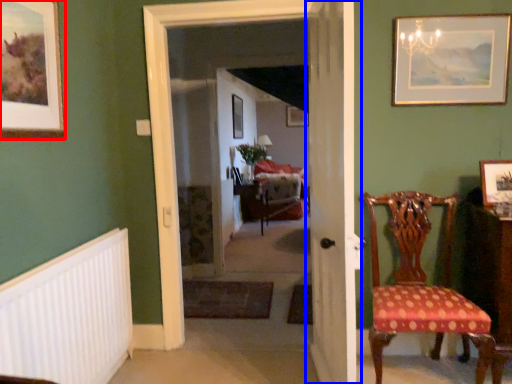
Question: Which object is closer to the camera taking this photo, picture frame (highlighted by a red box) or door (highlighted by a blue box)?

Choices:
 (A) picture frame
 (B) door

Answer: (A)